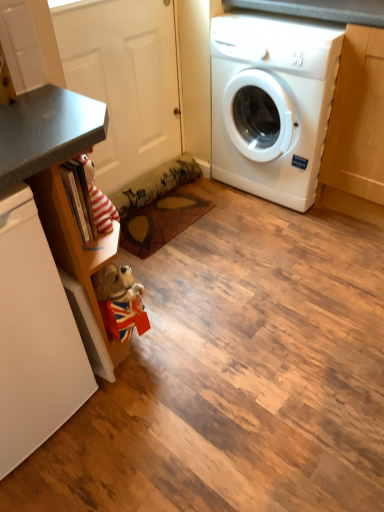
The image size is (384, 512). Find the location of `white glossy washing machine at right`. white glossy washing machine at right is located at coordinates (271, 104).

What is the approximate height of white glossy washing machine at right?

87.32 centimeters.

Describe the element at coordinates (271, 104) in the screenshot. I see `white glossy washing machine at right` at that location.

This screenshot has height=512, width=384. What do you see at coordinates (34, 336) in the screenshot? I see `white matte dishwasher at left` at bounding box center [34, 336].

At what (x,y) coordinates should I click in order to perform the action: click on white matte dishwasher at left. Please return your answer as a coordinate pair (x, y). Looking at the image, I should click on (34, 336).

Where is `white glossy washing machine at right`? This screenshot has height=512, width=384. white glossy washing machine at right is located at coordinates (271, 104).

Which object is positioned more to the left, white glossy washing machine at right or white matte dishwasher at left?

Positioned to the left is white matte dishwasher at left.

Does white glossy washing machine at right lie in front of white matte dishwasher at left?

No, white glossy washing machine at right is further to the viewer.

Does point (275, 81) come closer to viewer compared to point (16, 465)?

No, (275, 81) is further to viewer.

From the image's perspective, is white glossy washing machine at right below white matte dishwasher at left?

Incorrect, from the image's perspective, white glossy washing machine at right is higher than white matte dishwasher at left.

From a real-world perspective, who is located higher, white glossy washing machine at right or white matte dishwasher at left?

From a 3D spatial view, white glossy washing machine at right is above.

Considering the relative sizes of white glossy washing machine at right and white matte dishwasher at left in the image provided, is white glossy washing machine at right thinner than white matte dishwasher at left?

Indeed, white glossy washing machine at right has a lesser width compared to white matte dishwasher at left.

From their relative heights in the image, would you say white glossy washing machine at right is taller or shorter than white matte dishwasher at left?

white glossy washing machine at right is taller than white matte dishwasher at left.

Based on their sizes in the image, would you say white glossy washing machine at right is bigger or smaller than white matte dishwasher at left?

Considering their sizes, white glossy washing machine at right takes up more space than white matte dishwasher at left.

Would you say white glossy washing machine at right is outside white matte dishwasher at left?

That's correct, white glossy washing machine at right is outside of white matte dishwasher at left.

Is white glossy washing machine at right in contact with white matte dishwasher at left?

No, white glossy washing machine at right is not making contact with white matte dishwasher at left.

Does white glossy washing machine at right turn towards white matte dishwasher at left?

Yes, white glossy washing machine at right is oriented towards white matte dishwasher at left.

This screenshot has width=384, height=512. Find the location of `washing machine above the white matte dishwasher at left (from the image's perspective)`. washing machine above the white matte dishwasher at left (from the image's perspective) is located at coordinates (271, 104).

Based on the photo, based on their positions, is white matte dishwasher at left located to the left or right of white glossy washing machine at right?

Clearly, white matte dishwasher at left is on the left of white glossy washing machine at right in the image.

Consider the image. Is white matte dishwasher at left closer to camera compared to white glossy washing machine at right?

Yes, the depth of white matte dishwasher at left is less than that of white glossy washing machine at right.

Between point (54, 330) and point (280, 96), which one is positioned behind?

The point (280, 96) is farther from the camera.

From the image's perspective, between white matte dishwasher at left and white glossy washing machine at right, which one is located above?

white glossy washing machine at right is shown above in the image.

From a real-world perspective, does white matte dishwasher at left stand above white glossy washing machine at right?

No, from a real-world perspective, white matte dishwasher at left is not above white glossy washing machine at right.

Which of these two, white matte dishwasher at left or white glossy washing machine at right, is thinner?

With smaller width is white glossy washing machine at right.

Who is shorter, white matte dishwasher at left or white glossy washing machine at right?

Standing shorter between the two is white matte dishwasher at left.

Is white matte dishwasher at left smaller than white glossy washing machine at right?

Indeed, white matte dishwasher at left has a smaller size compared to white glossy washing machine at right.

Is white matte dishwasher at left inside the boundaries of white glossy washing machine at right, or outside?

white matte dishwasher at left lies outside white glossy washing machine at right.

Is white matte dishwasher at left in contact with white glossy washing machine at right?

No, white matte dishwasher at left is not next to white glossy washing machine at right.

Is white matte dishwasher at left facing away from white glossy washing machine at right?

That's not correct — white matte dishwasher at left is not looking away from white glossy washing machine at right.

In the image, there is a white matte dishwasher at left. Where is `washing machine above it (from the image's perspective)`? The width and height of the screenshot is (384, 512). washing machine above it (from the image's perspective) is located at coordinates (271, 104).

Where is `washing machine that is on the right side of white matte dishwasher at left`? washing machine that is on the right side of white matte dishwasher at left is located at coordinates (271, 104).

I want to click on washing machine above the white matte dishwasher at left (from a real-world perspective), so click(271, 104).